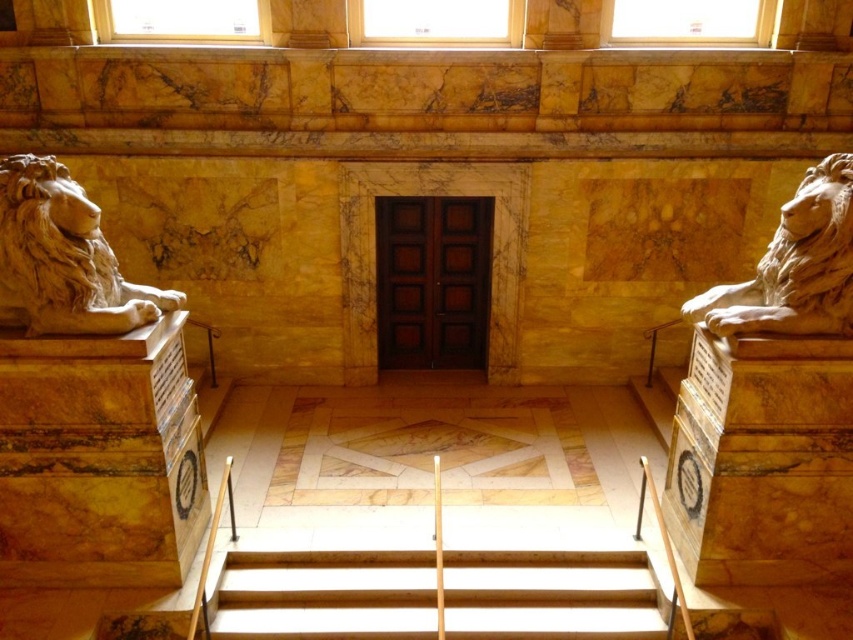
You are an interior designer planning to place a 1.5 meter wide decorative rug in this space. Considering the wooden stairs at center and the white marble lion at right, which object should the rug be placed closer to to ensure it fits without overlapping either?

The wooden stairs at center is wider than the white marble lion at right. Therefore, placing the rug closer to the white marble lion at right would ensure it fits within the available space without overlapping either object.